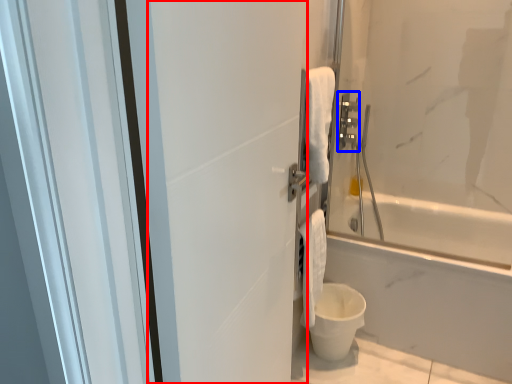
Question: Which point is further to the camera, screen door (highlighted by a red box) or towel bar (highlighted by a blue box)?

Choices:
 (A) screen door
 (B) towel bar

Answer: (B)